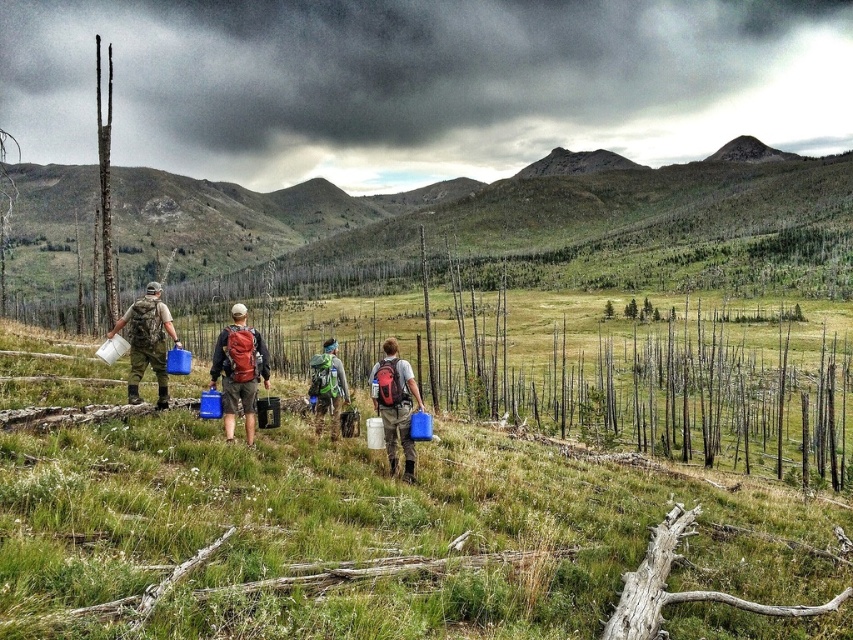
You are planning to take a photo of the dark gray cloud at upper center and the smooth brown tree trunk at left. Which object should you focus on first if you want to capture both in a single frame without moving the camera? Explain your reasoning based on their sizes.

You should focus on the dark gray cloud at upper center first because its width is larger than the smooth brown tree trunk at left, making it the dominant object in the frame. By centering the camera on the cloud and adjusting the aperture to ensure depth of field, both objects can be captured clearly without moving the camera.

You are a hiker planning to move from the smooth brown tree trunk at left to the matte red backpack at center. Based on the scene, which direction should you move to reach the backpack?

The matte red backpack at center is below the smooth brown tree trunk at left. Therefore, you should move downward from the smooth brown tree trunk at left to reach the matte red backpack at center.